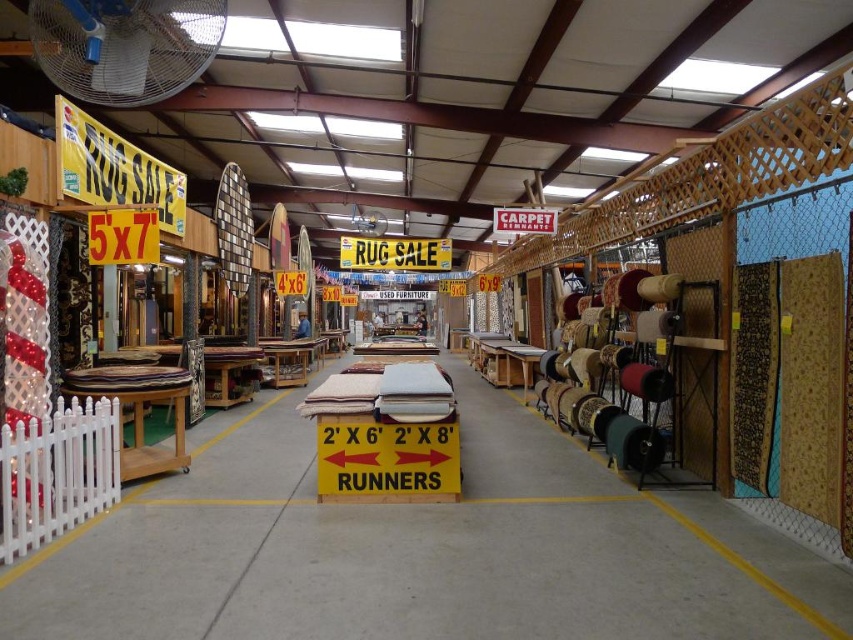
Is yellowmaterial/texturesign at center positioned behind red carpet remnant at center?

Yes, yellowmaterial/texturesign at center is further from the viewer.

Does point (398, 257) come closer to viewer compared to point (508, 228)?

No, (398, 257) is further to viewer.

At what (x,y) coordinates should I click in order to perform the action: click on yellowmaterial/texturesign at center. Please return your answer as a coordinate pair (x, y). Looking at the image, I should click on (393, 253).

Can you confirm if white plastic fan at upper left is wider than white plastic fan at center?

Yes.

Describe the element at coordinates (125, 45) in the screenshot. The image size is (853, 640). I see `white plastic fan at upper left` at that location.

The height and width of the screenshot is (640, 853). What do you see at coordinates (125, 45) in the screenshot? I see `white plastic fan at upper left` at bounding box center [125, 45].

This screenshot has height=640, width=853. Find the location of `white plastic fan at upper left`. white plastic fan at upper left is located at coordinates (125, 45).

Which is more to the left, white plastic fan at upper left or yellowmaterial/texturesign at center?

white plastic fan at upper left

Which is more to the right, white plastic fan at upper left or yellowmaterial/texturesign at center?

Positioned to the right is yellowmaterial/texturesign at center.

Measure the distance between white plastic fan at upper left and camera.

white plastic fan at upper left and camera are 4.33 meters apart from each other.

Where is `white plastic fan at upper left`? white plastic fan at upper left is located at coordinates (125, 45).